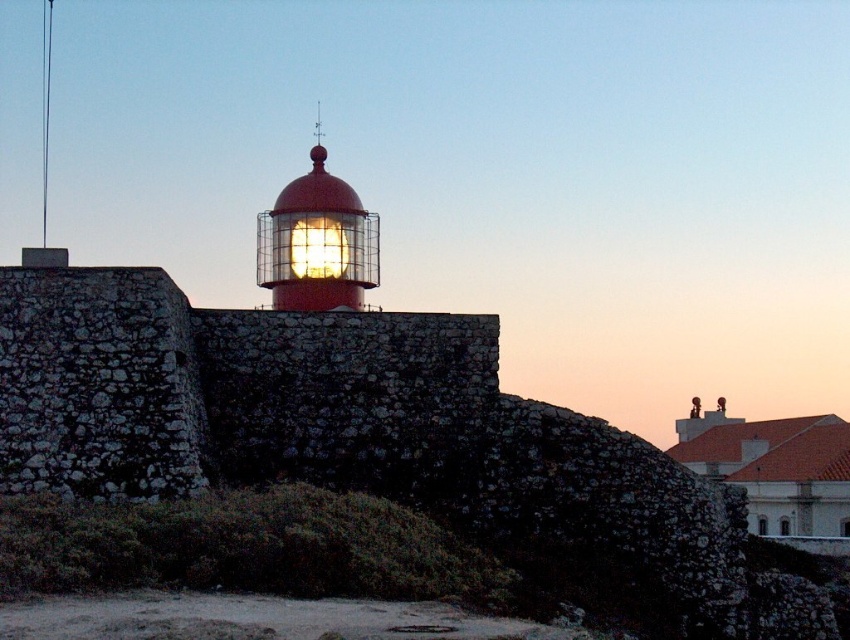
You are a painter standing in front of the lighthouse. You want to paint the matte red lighthouse at center and the matte glass lighthouse at center. Which one should you paint first to avoid covering the other?

The matte red lighthouse at center is above the matte glass lighthouse at center, so you should paint the matte glass lighthouse at center first to avoid covering it.

You are a painter standing 20 feet away from the matte red lighthouse at center and the matte glass lighthouse at center. Can you fit both lighthouses into your painting without any overlap?

The matte red lighthouse at center and the matte glass lighthouse at center are 17.58 feet apart. Since you are standing 20 feet away from them, the distance between them is less than your viewing distance, so both can fit into your painting without overlapping.

What are the coordinates of the matte red lighthouse at center?

The coordinates of the matte red lighthouse at center are point (316, 243).